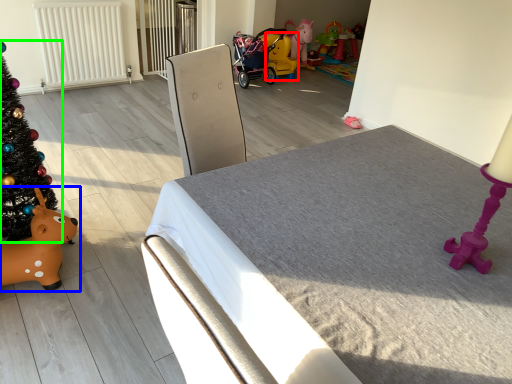
Question: Which object is positioned closest to toy (highlighted by a red box)? Select from toy (highlighted by a blue box) and christmas tree (highlighted by a green box).

Choices:
 (A) toy
 (B) christmas tree

Answer: (B)